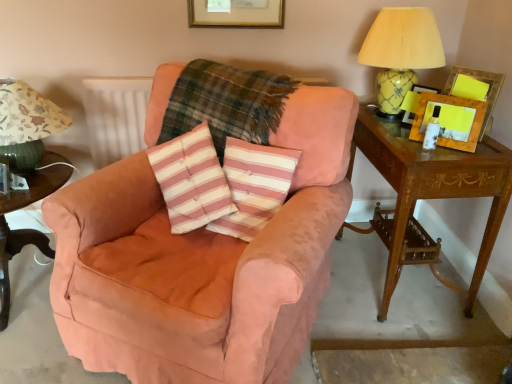
The image size is (512, 384). I want to click on vacant region in front of wooden picture frame at right, which is counted as the second picture frame, starting from the right, so click(x=449, y=153).